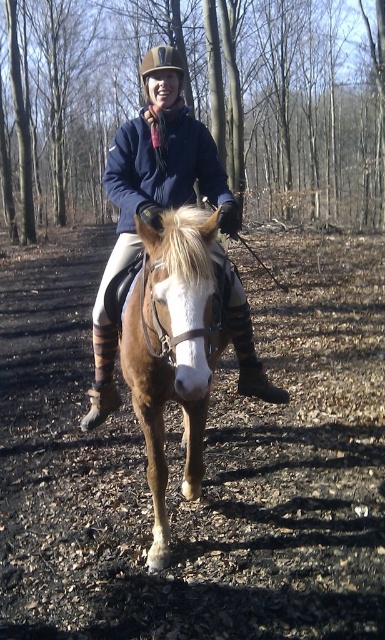
Is brown glossy horse at center shorter than matte blue jacket at center?

Indeed, brown glossy horse at center has a lesser height compared to matte blue jacket at center.

Find the location of a particular element. The height and width of the screenshot is (640, 385). brown glossy horse at center is located at coordinates (172, 348).

The width and height of the screenshot is (385, 640). Identify the location of brown glossy horse at center. (172, 348).